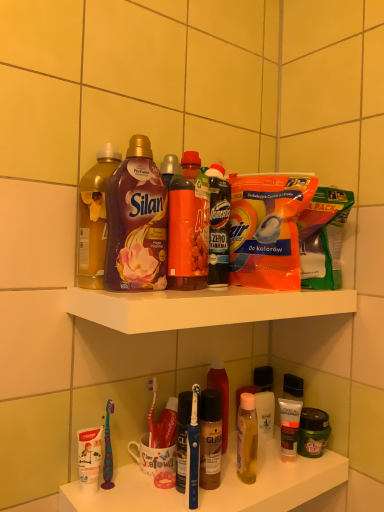
Locate an element on the screen. The width and height of the screenshot is (384, 512). free spot above white plastic shelf at upper center (from a real-world perspective) is located at coordinates (222, 289).